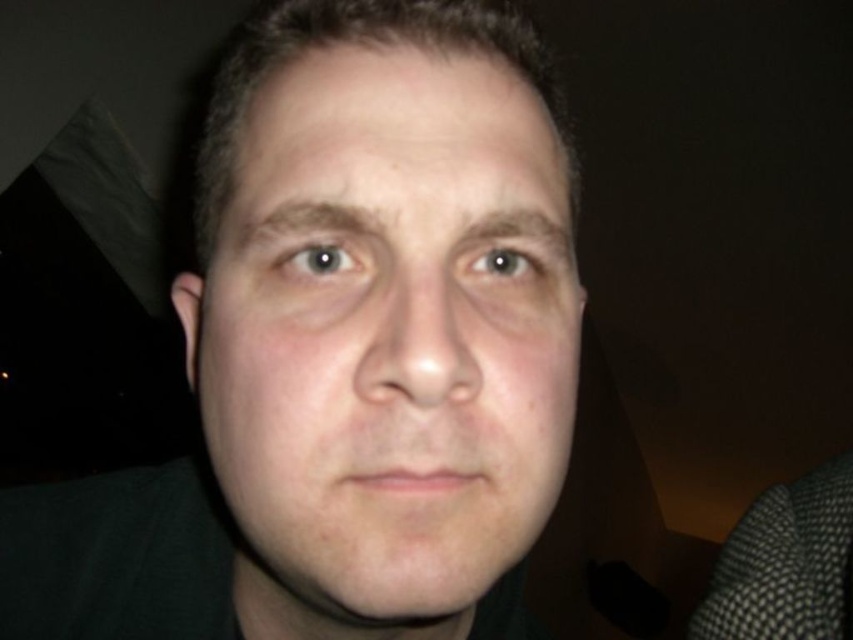
Measure the distance between smooth skin face at center and camera.

8.26 inches

Can you confirm if smooth skin face at center is positioned above blue glossy eye at upper left?

Actually, smooth skin face at center is below blue glossy eye at upper left.

Is point (433, 433) positioned in front of point (314, 257)?

Yes, it is.

This screenshot has height=640, width=853. I want to click on smooth skin face at center, so click(386, 337).

Can you confirm if smooth skin face at center is positioned above light brown eye at center?

No, smooth skin face at center is not above light brown eye at center.

At what (x,y) coordinates should I click in order to perform the action: click on smooth skin face at center. Please return your answer as a coordinate pair (x, y). This screenshot has width=853, height=640. Looking at the image, I should click on (386, 337).

In the scene shown: Does blue glossy eye at upper left lie behind light brown eye at center?

That is False.

Identify the location of blue glossy eye at upper left. The width and height of the screenshot is (853, 640). (318, 260).

I want to click on blue glossy eye at upper left, so click(x=318, y=260).